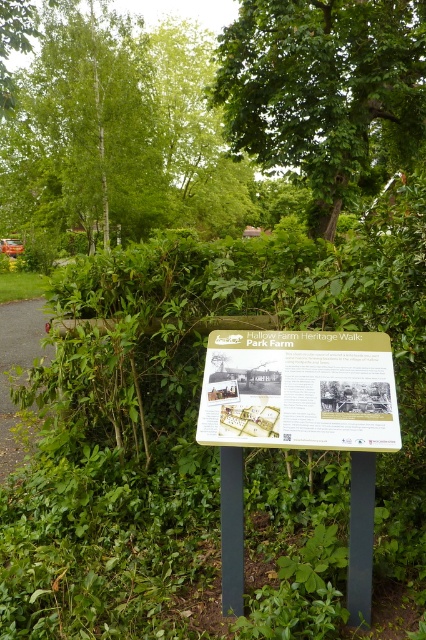
Based on the scene description, where is the green leafy tree at upper center located in terms of its 2D coordinates?

The green leafy tree at upper center is located at coordinates (x=322, y=90).

You are a visitor at Hallow Farm Heritage Walk and want to take a photo of the green leafy tree at upper center and the gravel path at left. Which object should you focus on first if you want to capture both in a single frame without moving the camera?

The green leafy tree at upper center has a smaller size compared to gravel path at left, so you should focus on the gravel path at left first since it is closer to the camera, ensuring both objects are in focus.